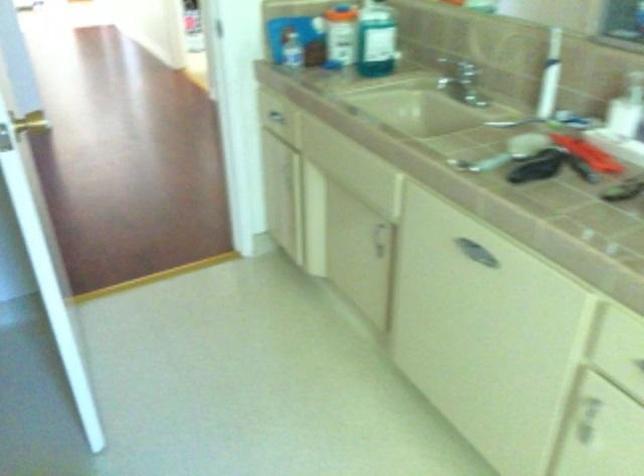
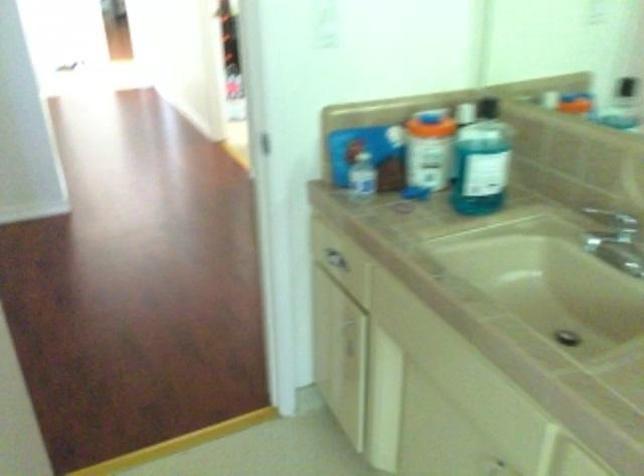
Question: Which direction would the cameraman need to move to produce the second image? Reply with the corresponding letter.

Choices:
 (A) Left
 (B) Right
 (C) Forward
 (D) Backward

Answer: (C)